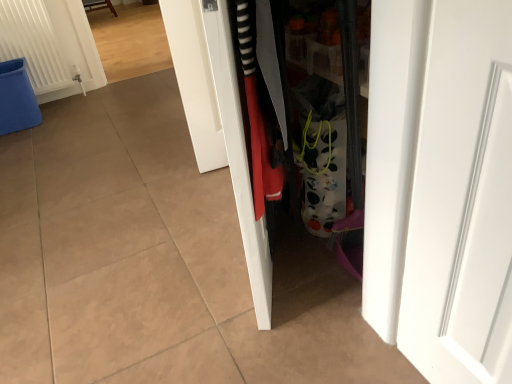
Locate an element on the screen. white textured radiator at left is located at coordinates (32, 43).

The width and height of the screenshot is (512, 384). Describe the element at coordinates (32, 43) in the screenshot. I see `white textured radiator at left` at that location.

In order to face white textured radiator at left, should I rotate leftwards or rightwards?

It's best to rotate left around 27.329 degrees.

At what (x,y) coordinates should I click in order to perform the action: click on white textured radiator at left. Please return your answer as a coordinate pair (x, y). The width and height of the screenshot is (512, 384). Looking at the image, I should click on (32, 43).